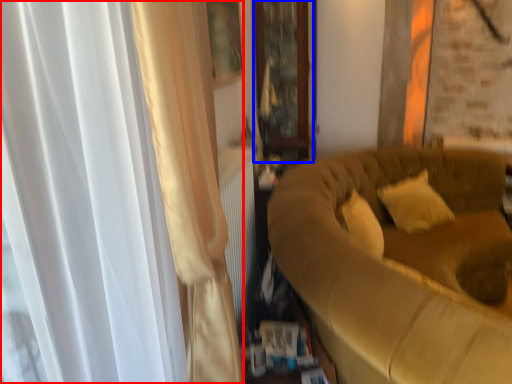
Question: Among these objects, which one is nearest to the camera, curtain (highlighted by a red box) or glass door (highlighted by a blue box)?

Choices:
 (A) curtain
 (B) glass door

Answer: (A)